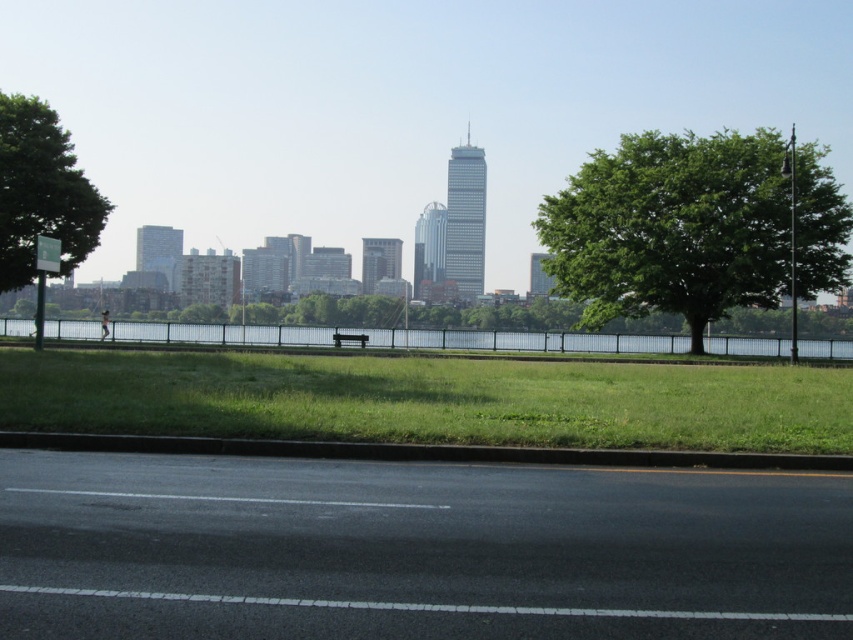
You are standing at the origin point of the park map. A green leafy tree at right is located at point (694, 227). Can you determine the direction of the green leafy tree at right from your current position?

The green leafy tree at right is located at point (694, 227), which is to the northeast direction from your current position at the origin.